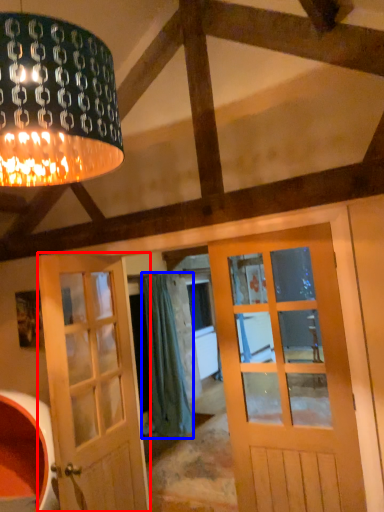
Question: Which object appears farthest to the camera in this image, door (highlighted by a red box) or curtain (highlighted by a blue box)?

Choices:
 (A) door
 (B) curtain

Answer: (B)